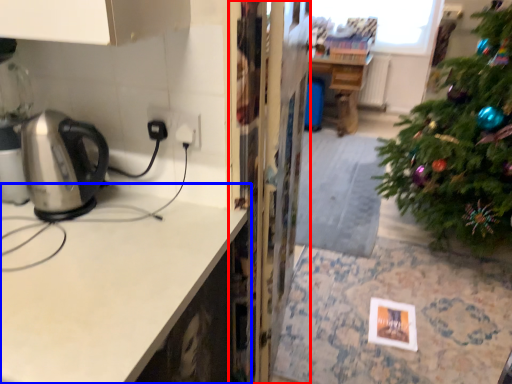
Question: Which object appears farthest to the camera in this image, screen door (highlighted by a red box) or countertop (highlighted by a blue box)?

Choices:
 (A) screen door
 (B) countertop

Answer: (A)